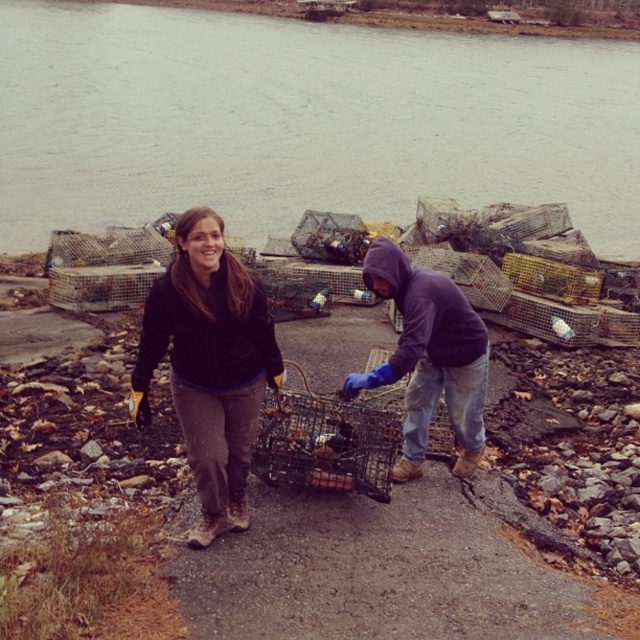
Can you confirm if gray water at upper center is thinner than black fleece jacket at center?

No.

Which is above, gray water at upper center or black fleece jacket at center?

gray water at upper center is above.

At what (x,y) coordinates should I click in order to perform the action: click on gray water at upper center. Please return your answer as a coordinate pair (x, y). Looking at the image, I should click on (301, 122).

Which of these two, gray water at upper center or matte blue gloves at center, stands shorter?

Standing shorter between the two is matte blue gloves at center.

Can you confirm if gray water at upper center is bigger than matte blue gloves at center?

Correct, gray water at upper center is larger in size than matte blue gloves at center.

Does point (90, 161) come behind point (452, 378)?

Yes, it is behind point (452, 378).

At what (x,y) coordinates should I click in order to perform the action: click on gray water at upper center. Please return your answer as a coordinate pair (x, y). This screenshot has width=640, height=640. Looking at the image, I should click on pos(301,122).

Between point (208, 428) and point (422, 314), which one is positioned behind?

The point (422, 314) is behind.

Does black fleece jacket at center have a smaller size compared to matte blue gloves at center?

Indeed, black fleece jacket at center has a smaller size compared to matte blue gloves at center.

Which is behind, point (241, 337) or point (408, 396)?

The point (408, 396) is more distant.

You are a GUI agent. You are given a task and a screenshot of the screen. Output one action in this format:
    pyautogui.click(x=<x>, y=<y>)
    Task: Click on the black fleece jacket at center
    
    Given the screenshot: What is the action you would take?
    pyautogui.click(x=209, y=364)